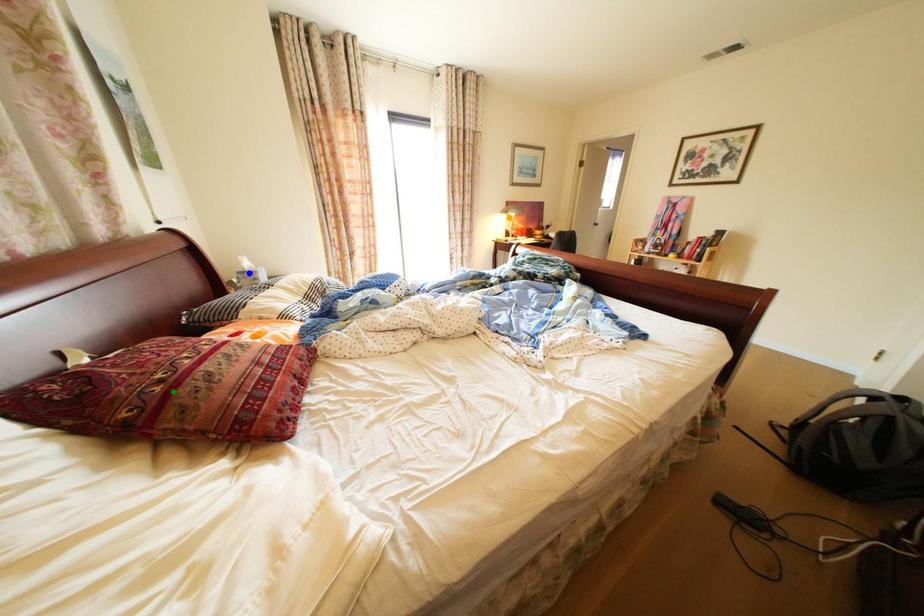
Order these from nearest to farthest:
orange point, blue point, green point

1. green point
2. blue point
3. orange point